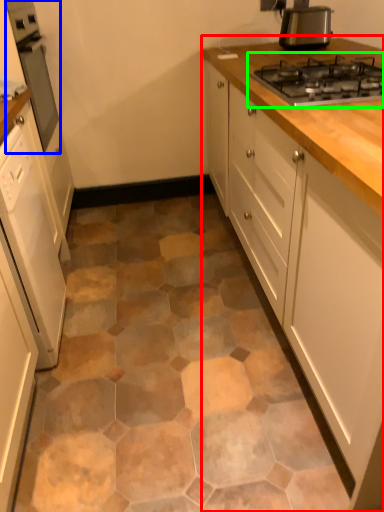
Question: Which is nearer to the cabinetry (highlighted by a red box)? home appliance (highlighted by a blue box) or gas stove (highlighted by a green box).

Choices:
 (A) home appliance
 (B) gas stove

Answer: (B)